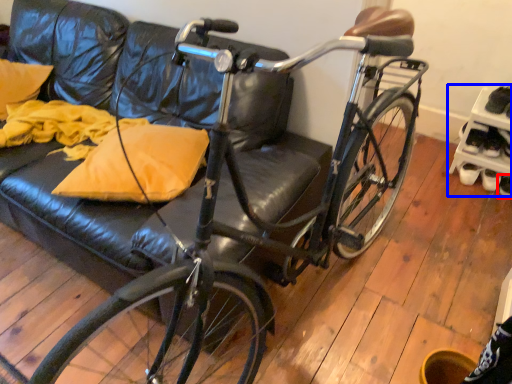
Question: Among these objects, which one is farthest to the camera, footwear (highlighted by a red box) or shelf (highlighted by a blue box)?

Choices:
 (A) footwear
 (B) shelf

Answer: (A)